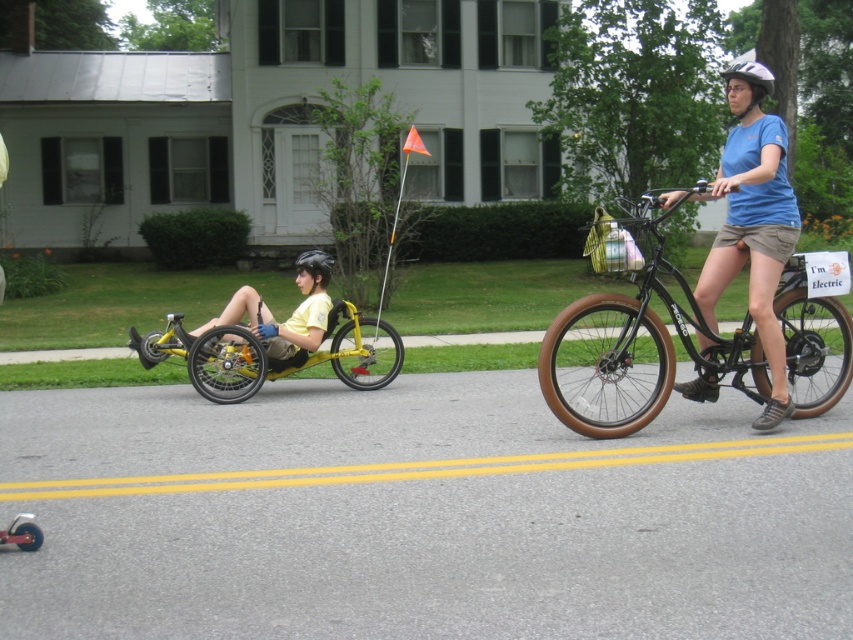
Question: Is brown rubber bicycle at right above yellow matte tricycle at left?

Choices:
 (A) yes
 (B) no

Answer: (A)

Question: In this image, where is blue fabric shirt at upper right located relative to yellow matte tricycle at left?

Choices:
 (A) left
 (B) right

Answer: (B)

Question: Is brown rubber bicycle at right wider than blue fabric shirt at upper right?

Choices:
 (A) yes
 (B) no

Answer: (B)

Question: Which point is closer to the camera?

Choices:
 (A) (743, 106)
 (B) (360, 360)

Answer: (A)

Question: Considering the real-world distances, which object is farthest from the brown rubber bicycle at right?

Choices:
 (A) blue fabric shirt at upper right
 (B) white matte bicycle helmet at upper center
 (C) yellow matte tricycle at left

Answer: (C)

Question: Which object is the closest to the yellow matte tricycle at left?

Choices:
 (A) blue fabric shirt at upper right
 (B) brown rubber bicycle at right
 (C) white matte bicycle helmet at upper center
 (D) black matte helmet at center

Answer: (D)